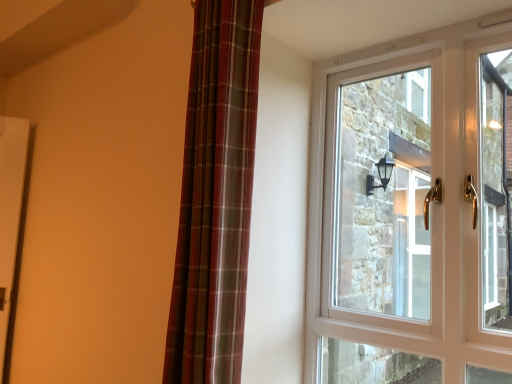
Question: Considering the relative sizes of plaid fabric curtain at left and white glossy door at upper right in the image provided, is plaid fabric curtain at left thinner than white glossy door at upper right?

Choices:
 (A) yes
 (B) no

Answer: (B)

Question: Is plaid fabric curtain at left smaller than white glossy door at upper right?

Choices:
 (A) yes
 (B) no

Answer: (B)

Question: Is plaid fabric curtain at left beside white glossy door at upper right?

Choices:
 (A) yes
 (B) no

Answer: (B)

Question: From the image's perspective, is plaid fabric curtain at left above white glossy door at upper right?

Choices:
 (A) no
 (B) yes

Answer: (B)

Question: Can you confirm if plaid fabric curtain at left is taller than white glossy door at upper right?

Choices:
 (A) no
 (B) yes

Answer: (A)

Question: Would you say plaid fabric curtain at left is a long distance from white glossy door at upper right?

Choices:
 (A) yes
 (B) no

Answer: (A)

Question: From the image's perspective, would you say white glossy door at upper right is positioned over plaid fabric curtain at left?

Choices:
 (A) no
 (B) yes

Answer: (A)

Question: Is white glossy door at upper right placed right next to plaid fabric curtain at left?

Choices:
 (A) yes
 (B) no

Answer: (B)

Question: Is white glossy door at upper right shorter than plaid fabric curtain at left?

Choices:
 (A) no
 (B) yes

Answer: (A)

Question: From a real-world perspective, is white glossy door at upper right positioned over plaid fabric curtain at left based on gravity?

Choices:
 (A) yes
 (B) no

Answer: (B)

Question: Does white glossy door at upper right turn towards plaid fabric curtain at left?

Choices:
 (A) yes
 (B) no

Answer: (A)

Question: Is white glossy door at upper right completely or partially outside of plaid fabric curtain at left?

Choices:
 (A) no
 (B) yes

Answer: (B)

Question: In the image, is white glossy door at upper right positioned in front of or behind plaid fabric curtain at left?

Choices:
 (A) front
 (B) behind

Answer: (B)